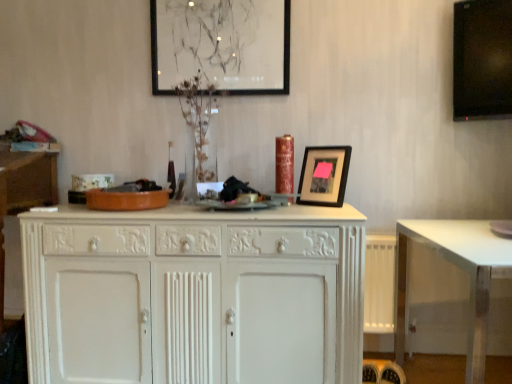
What do you see at coordinates (221, 44) in the screenshot? I see `black matte picture frame at upper center, arranged as the second picture frame when ordered from the bottom` at bounding box center [221, 44].

You are a GUI agent. You are given a task and a screenshot of the screen. Output one action in this format:
    pyautogui.click(x=<x>, y=<y>)
    Task: Click on the white painted wood cabinet at center
    
    Given the screenshot: What is the action you would take?
    pyautogui.click(x=194, y=295)

Identify the location of white glossy table at lower right. (461, 269).

You are a GUI agent. You are given a task and a screenshot of the screen. Output one action in this format:
    pyautogui.click(x=<x>, y=<y>)
    Task: Click on the white wood cabinet at left
    The image size is (512, 384).
    Given the screenshot: What is the action you would take?
    pyautogui.click(x=24, y=192)

Can black glossy monitor at upper right be found inside black matte picture frame at upper center, which appears as the second picture frame when viewed from the left?

No, black glossy monitor at upper right is not surrounded by black matte picture frame at upper center, which appears as the second picture frame when viewed from the left.

Is black matte picture frame at upper center, acting as the first picture frame starting from the right, oriented away from black glossy monitor at upper right?

No, black matte picture frame at upper center, acting as the first picture frame starting from the right, is not facing away from black glossy monitor at upper right.

Between black matte picture frame at upper center, the 2th picture frame in the back-to-front sequence, and black glossy monitor at upper right, which one has smaller width?

black glossy monitor at upper right is thinner.

How different are the orientations of black matte picture frame at upper center, the second picture frame in the top-to-bottom sequence, and black glossy monitor at upper right in degrees?

The facing directions of black matte picture frame at upper center, the second picture frame in the top-to-bottom sequence, and black glossy monitor at upper right are 3.04 degrees apart.

Is white glossy table at lower right completely or partially outside of white painted wood cabinet at center?

white glossy table at lower right lies outside white painted wood cabinet at center's area.

Does white glossy table at lower right have a smaller size compared to white painted wood cabinet at center?

Yes, white glossy table at lower right is smaller than white painted wood cabinet at center.

From a real-world perspective, which object stands above the other?

white painted wood cabinet at center is physically above.

Is white painted wood cabinet at center wider than white wood cabinet at left?

Correct, the width of white painted wood cabinet at center exceeds that of white wood cabinet at left.

Who is shorter, white painted wood cabinet at center or white wood cabinet at left?

white painted wood cabinet at center.

From the image's perspective, which one is positioned lower, white painted wood cabinet at center or white wood cabinet at left?

From the image's view, white painted wood cabinet at center is below.

Is white painted wood cabinet at center completely or partially outside of black matte picture frame at upper center, which appears as the second picture frame when viewed from the left?

Yes, white painted wood cabinet at center is outside of black matte picture frame at upper center, which appears as the second picture frame when viewed from the left.

From a real-world perspective, which object stands above the other?

In real-world perspective, black matte picture frame at upper center, the second picture frame in the top-to-bottom sequence, is above.

Is white painted wood cabinet at center facing towards black matte picture frame at upper center, which is counted as the 1th picture frame, starting from the bottom?

No, white painted wood cabinet at center is not facing towards black matte picture frame at upper center, which is counted as the 1th picture frame, starting from the bottom.

Is point (84, 346) in front of point (313, 188)?

Yes, it is in front of point (313, 188).

How far apart are black matte picture frame at upper center, arranged as the second picture frame when ordered from the bottom, and white wood cabinet at left?

The distance of black matte picture frame at upper center, arranged as the second picture frame when ordered from the bottom, from white wood cabinet at left is 1.00 meters.

Can you confirm if black matte picture frame at upper center, arranged as the second picture frame when ordered from the bottom, is wider than white wood cabinet at left?

Incorrect, the width of black matte picture frame at upper center, arranged as the second picture frame when ordered from the bottom, does not surpass that of white wood cabinet at left.

Between black matte picture frame at upper center, arranged as the second picture frame when ordered from the bottom, and white wood cabinet at left, which one has more height?

white wood cabinet at left is taller.

Based on the photo, does black matte picture frame at upper center, which is the 2th picture frame in right-to-left order, touch white wood cabinet at left?

black matte picture frame at upper center, which is the 2th picture frame in right-to-left order, and white wood cabinet at left are clearly separated.

Considering the points (204, 98) and (188, 316), which point is behind, point (204, 98) or point (188, 316)?

The point (204, 98) is more distant.

From a real-world perspective, which object stands above the other?

clear glass vase at center is physically above.

Is clear glass vase at center wider than white painted wood cabinet at center?

In fact, clear glass vase at center might be narrower than white painted wood cabinet at center.

Considering the relative sizes of clear glass vase at center and white painted wood cabinet at center in the image provided, is clear glass vase at center smaller than white painted wood cabinet at center?

Yes.

What's the angular difference between black matte picture frame at upper center, arranged as the 1th picture frame when viewed from the back, and white painted wood cabinet at center's facing directions?

black matte picture frame at upper center, arranged as the 1th picture frame when viewed from the back, and white painted wood cabinet at center are facing 0.119 degrees away from each other.

From the image's perspective, would you say black matte picture frame at upper center, arranged as the 1th picture frame when viewed from the back, is positioned over white painted wood cabinet at center?

Correct, black matte picture frame at upper center, arranged as the 1th picture frame when viewed from the back, appears higher than white painted wood cabinet at center in the image.

Is black matte picture frame at upper center, which is the 2th picture frame in right-to-left order, facing away from white painted wood cabinet at center?

No, black matte picture frame at upper center, which is the 2th picture frame in right-to-left order, is not facing the opposite direction of white painted wood cabinet at center.

Considering the points (267, 58) and (343, 280), which point is behind, point (267, 58) or point (343, 280)?

Positioned behind is point (267, 58).

Locate an element on the screen. This screenshot has width=512, height=384. picture frame that is in front of the black glossy monitor at upper right is located at coordinates (324, 175).

Identify the location of table below the white painted wood cabinet at center (from the image's perspective). (461, 269).

Estimate the real-world distances between objects in this image. Which object is closer to white wood cabinet at left, black matte picture frame at upper center, the second picture frame in the top-to-bottom sequence, or white painted wood cabinet at center?

The object closer to white wood cabinet at left is white painted wood cabinet at center.

Which object lies nearer to the anchor point white wood cabinet at left, black matte picture frame at upper center, the second picture frame in the top-to-bottom sequence, or white glossy table at lower right?

black matte picture frame at upper center, the second picture frame in the top-to-bottom sequence.

Based on their spatial positions, is white painted wood cabinet at center or black matte picture frame at upper center, the 1th picture frame positioned from the left, further from black matte picture frame at upper center, the 2th picture frame in the back-to-front sequence?

The object further to black matte picture frame at upper center, the 2th picture frame in the back-to-front sequence, is black matte picture frame at upper center, the 1th picture frame positioned from the left.

Based on their spatial positions, is white glossy table at lower right or clear glass vase at center closer to black glossy monitor at upper right?

Based on the image, white glossy table at lower right appears to be nearer to black glossy monitor at upper right.

Which object lies further to the anchor point white wood cabinet at left, white glossy table at lower right or white painted wood cabinet at center?

white glossy table at lower right is positioned further to the anchor white wood cabinet at left.

From the image, which object appears to be farther from black matte picture frame at upper center, the 1th picture frame positioned from the left, white glossy table at lower right or white wood cabinet at left?

white glossy table at lower right is further to black matte picture frame at upper center, the 1th picture frame positioned from the left.

From the image, which object appears to be farther from black glossy monitor at upper right, white painted wood cabinet at center or clear glass vase at center?

white painted wood cabinet at center is positioned further to the anchor black glossy monitor at upper right.

Estimate the real-world distances between objects in this image. Which object is further from black glossy monitor at upper right, white glossy table at lower right or white wood cabinet at left?

white wood cabinet at left lies further to black glossy monitor at upper right than the other object.

Where is `cabinetry situated between white wood cabinet at left and black matte picture frame at upper center, which is counted as the 1th picture frame, starting from the bottom, from left to right`? The image size is (512, 384). cabinetry situated between white wood cabinet at left and black matte picture frame at upper center, which is counted as the 1th picture frame, starting from the bottom, from left to right is located at coordinates (194, 295).

This screenshot has width=512, height=384. Find the location of `picture frame between black glossy monitor at upper right and white glossy table at lower right in the vertical direction`. picture frame between black glossy monitor at upper right and white glossy table at lower right in the vertical direction is located at coordinates (324, 175).

In order to click on flower between black matte picture frame at upper center, arranged as the second picture frame when ordered from the bottom, and white painted wood cabinet at center, in the vertical direction in this screenshot , I will do `click(198, 117)`.

The height and width of the screenshot is (384, 512). Identify the location of cabinetry between black matte picture frame at upper center, the 1th picture frame positioned from the left, and white glossy table at lower right from top to bottom. (194, 295).